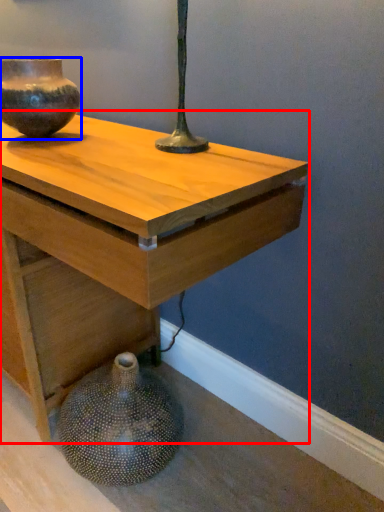
Question: Among these objects, which one is nearest to the camera, table (highlighted by a red box) or vase (highlighted by a blue box)?

Choices:
 (A) table
 (B) vase

Answer: (A)